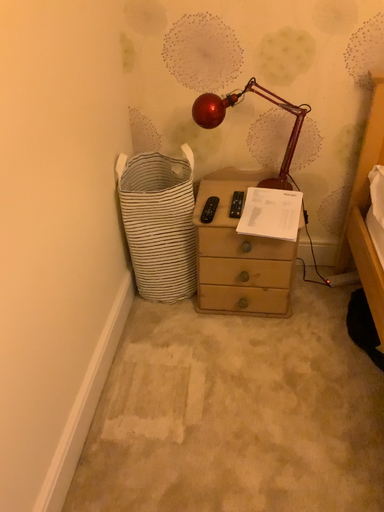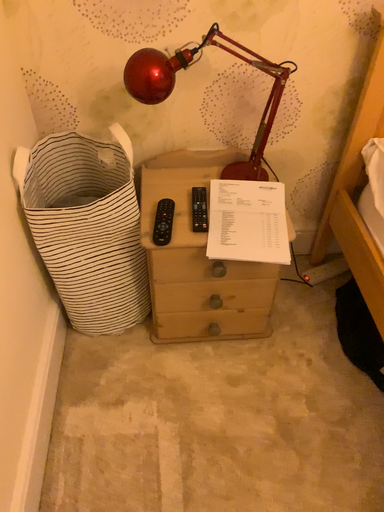
Question: Which way did the camera rotate in the video?

Choices:
 (A) rotated right
 (B) rotated left

Answer: (A)